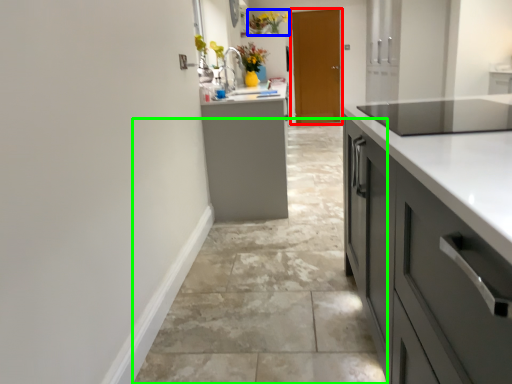
Question: Which object is the farthest from door (highlighted by a red box)? Choose among these: floral arrangement (highlighted by a blue box) or concrete (highlighted by a green box).

Choices:
 (A) floral arrangement
 (B) concrete

Answer: (B)